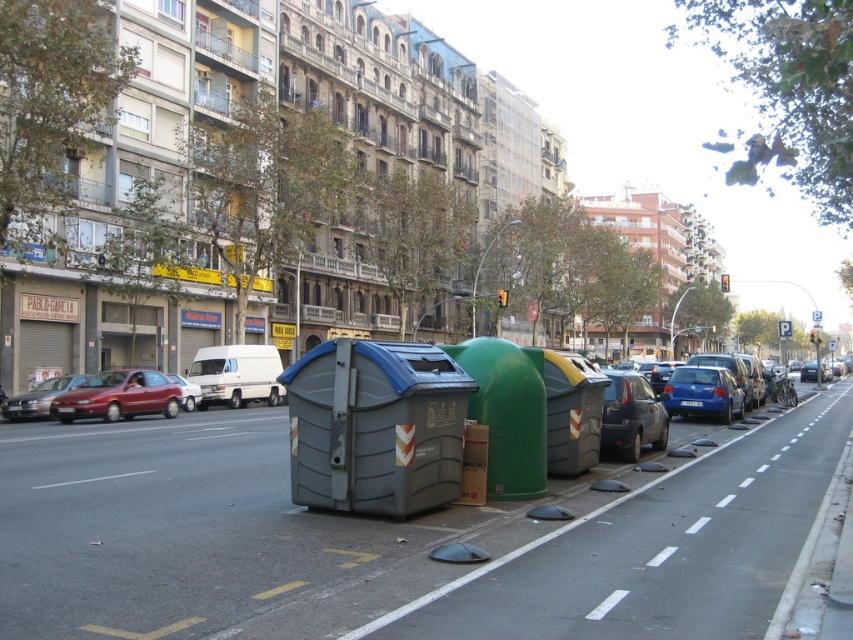
You are standing on the sidewalk in the urban street scene. You see two points marked in the image. Which point, point (744, 488) or point (19, 396), is closer to you?

Point (744, 488) is closer to the viewer than point (19, 396).

You are a pedestrian standing on the sidewalk looking at the street. You see the white dashed lines at lower right and the shiny silver sedan at left. Which object is closer to the curb?

The shiny silver sedan at left is closer to the curb because the white dashed lines at lower right are positioned to the right of it, indicating the sedan is nearer to the curb side.